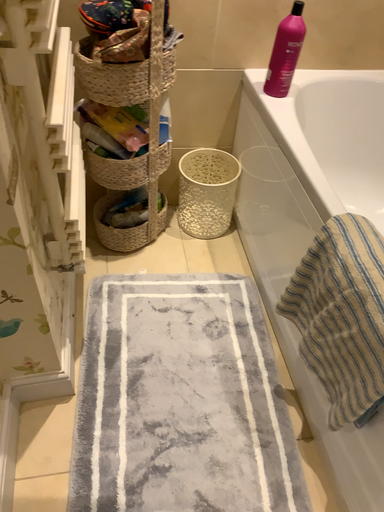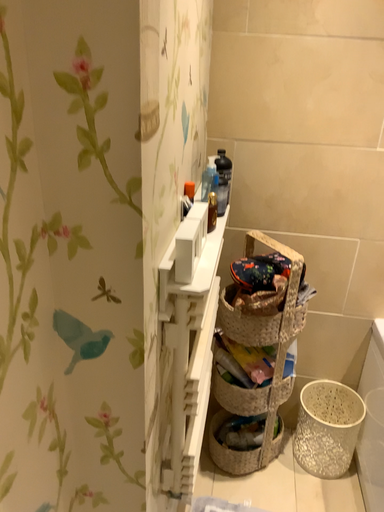
Question: Which way did the camera rotate in the video?

Choices:
 (A) rotated right
 (B) rotated left

Answer: (B)